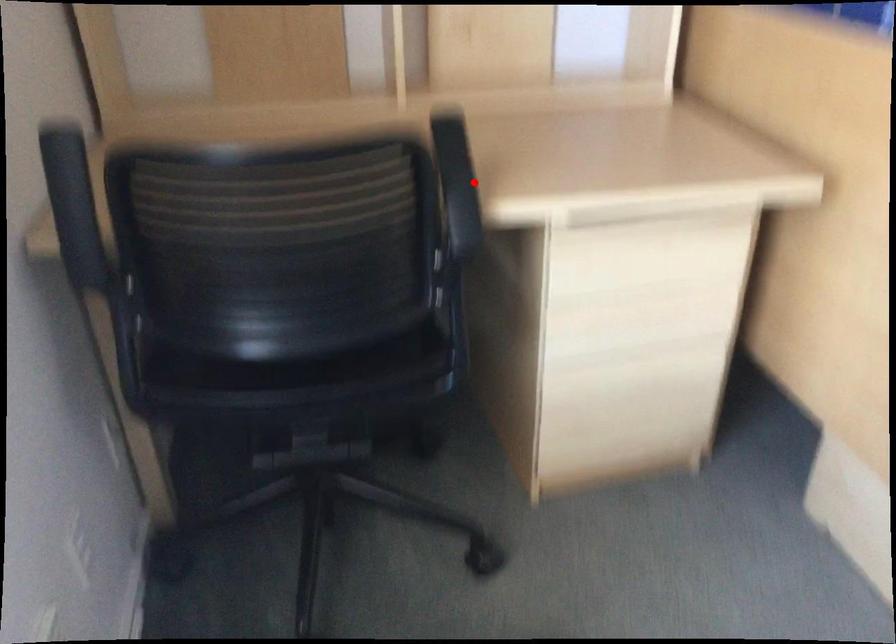
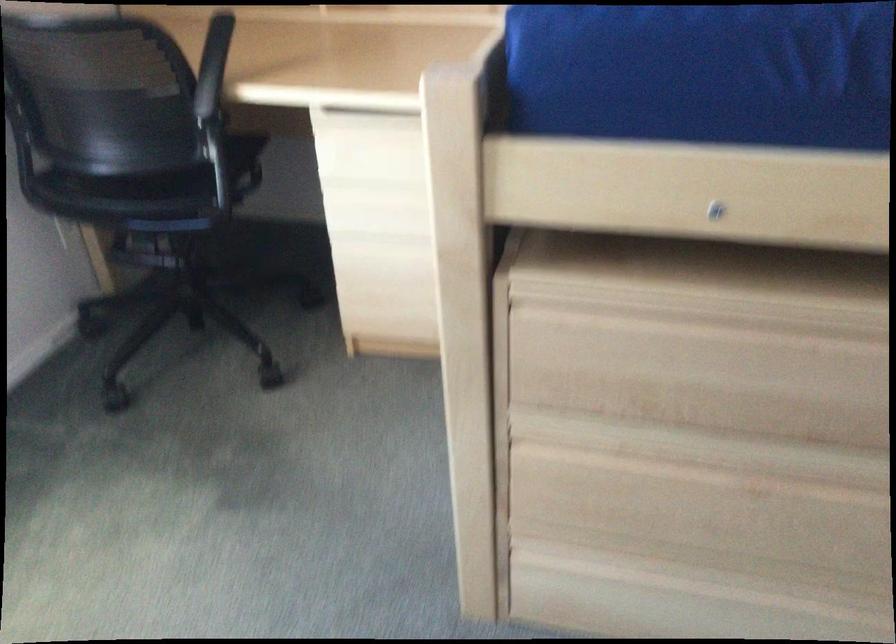
Where in the second image is the point corresponding to the highlighted location from the first image?

(212, 66)